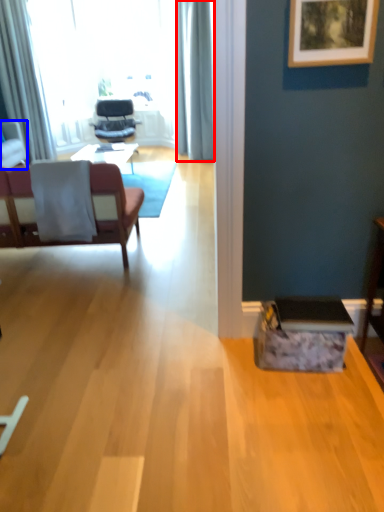
Question: Which of the following is the closest to the observer, curtain (highlighted by a red box) or chair (highlighted by a blue box)?

Choices:
 (A) curtain
 (B) chair

Answer: (B)